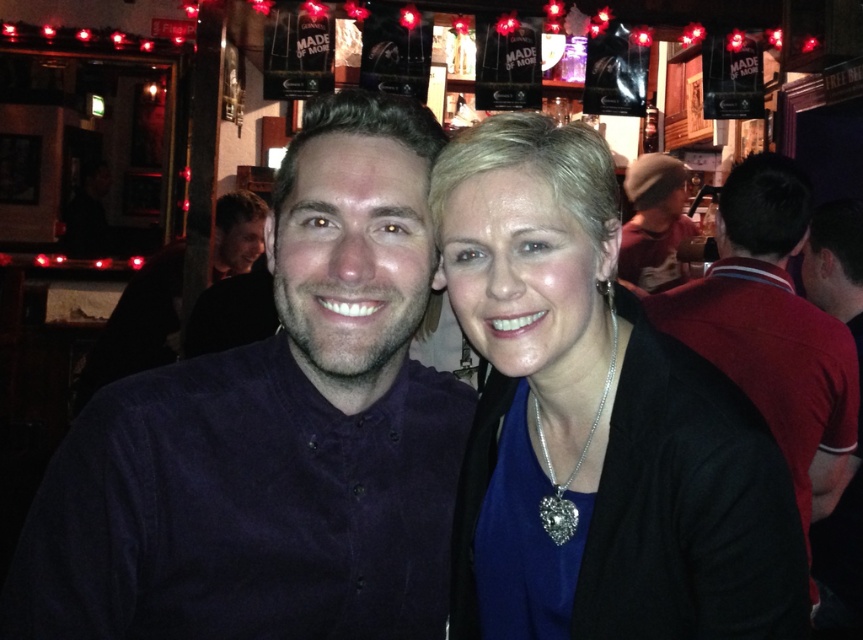
Can you confirm if matte black sweater at center is bigger than brown knit hat at upper right?

No.

Which of these two, matte black sweater at center or brown knit hat at upper right, stands shorter?

Standing shorter between the two is matte black sweater at center.

Describe the element at coordinates (597, 420) in the screenshot. This screenshot has height=640, width=863. I see `matte black sweater at center` at that location.

Identify the location of matte black sweater at center. (597, 420).

Measure the distance from dark blue corduroy shirt at center to dark red shirt at right.

They are 1.41 meters apart.

Does dark blue corduroy shirt at center lie in front of dark red shirt at right?

Yes, it is in front of dark red shirt at right.

Is point (398, 304) positioned after point (797, 180)?

That is False.

This screenshot has height=640, width=863. I want to click on dark blue corduroy shirt at center, so click(274, 433).

Is dark blue corduroy shirt at center shorter than matte black sweater at center?

Incorrect, dark blue corduroy shirt at center's height does not fall short of matte black sweater at center's.

Does dark blue corduroy shirt at center come behind matte black sweater at center?

That is False.

Which is behind, point (87, 525) or point (471, 534)?

Positioned behind is point (471, 534).

Find the location of a particular element. Image resolution: width=863 pixels, height=640 pixels. dark blue corduroy shirt at center is located at coordinates (274, 433).